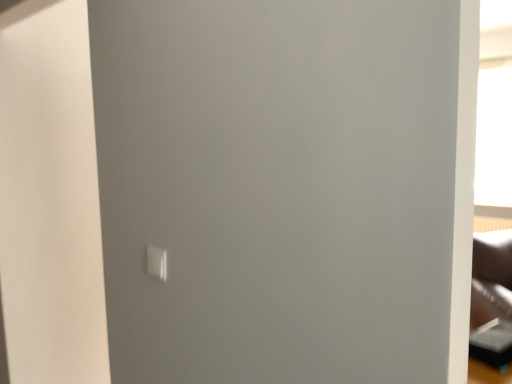
Measure the distance between point (160, 257) and camera.

A distance of 3.97 feet exists between point (160, 257) and camera.

What do you see at coordinates (157, 262) in the screenshot? I see `white plastic light switch at center` at bounding box center [157, 262].

Locate an element on the screen. The height and width of the screenshot is (384, 512). white plastic light switch at center is located at coordinates [157, 262].

Image resolution: width=512 pixels, height=384 pixels. Find the location of `white plastic light switch at center`. white plastic light switch at center is located at coordinates (157, 262).